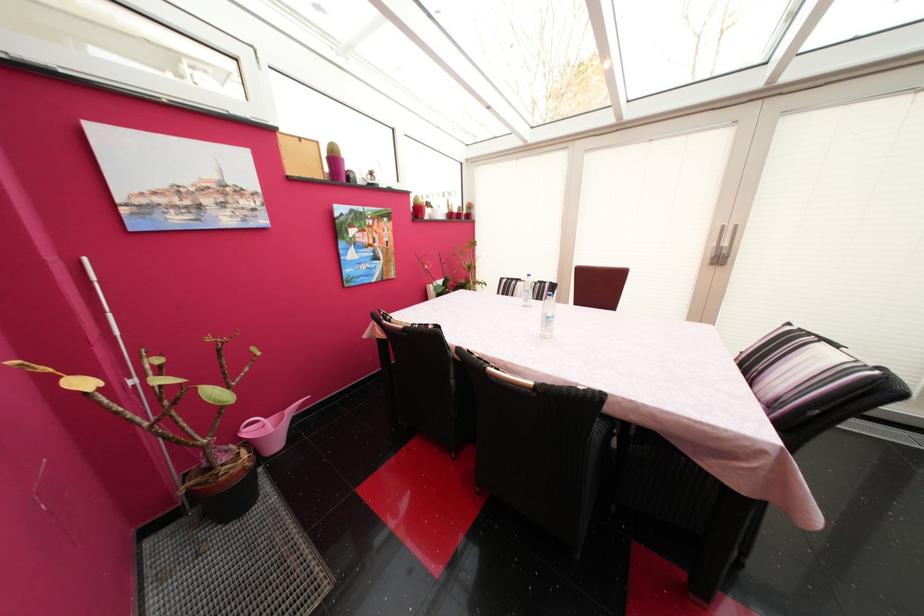
The location [269,430] corresponds to which object?

It corresponds to the pink cactus pot in the image.